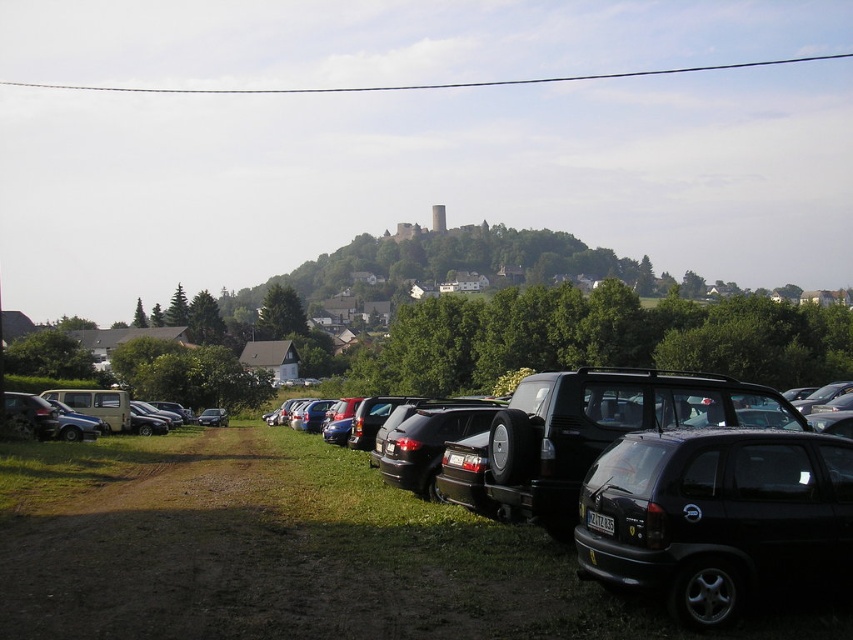
Does shiny black car at center have a larger size compared to black matte hatchback at lower right?

Correct, shiny black car at center is larger in size than black matte hatchback at lower right.

Can you confirm if shiny black car at center is thinner than black matte hatchback at lower right?

No.

Who is more forward, (508, 582) or (756, 582)?

Point (756, 582) is more forward.

The height and width of the screenshot is (640, 853). What are the coordinates of `shiny black car at center` in the screenshot? It's located at (422, 561).

Can you confirm if shiny black car at center is shorter than black wire at upper center?

Yes.

Which is below, shiny black car at center or black wire at upper center?

Positioned lower is shiny black car at center.

This screenshot has width=853, height=640. Describe the element at coordinates (422, 561) in the screenshot. I see `shiny black car at center` at that location.

Locate an element on the screen. The height and width of the screenshot is (640, 853). shiny black car at center is located at coordinates 422,561.

Consider the image. Can you confirm if black matte hatchback at lower right is positioned to the left of black wire at upper center?

In fact, black matte hatchback at lower right is to the right of black wire at upper center.

Which of these two, black matte hatchback at lower right or black wire at upper center, stands shorter?

black matte hatchback at lower right is shorter.

Identify the location of black matte hatchback at lower right. (717, 516).